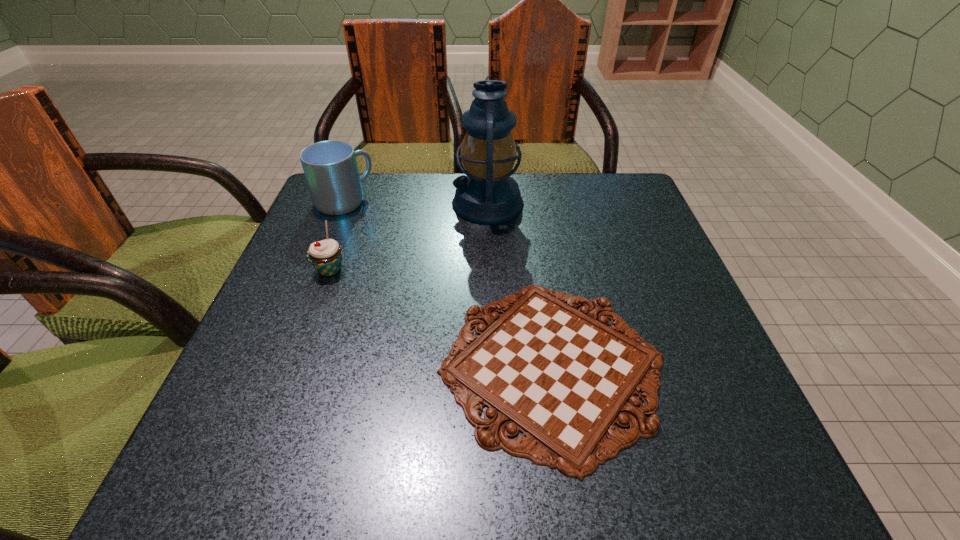
At what (x,y) coordinates should I click in order to perform the action: click on free space located on the right of the second nearest object. Please return your answer as a coordinate pair (x, y). The image size is (960, 540). Looking at the image, I should click on (450, 270).

Where is `free location located on the left of the shortest object`? The width and height of the screenshot is (960, 540). free location located on the left of the shortest object is located at coordinates (269, 365).

Find the location of `lantern positioned at the far edge`. lantern positioned at the far edge is located at coordinates [x=488, y=195].

This screenshot has width=960, height=540. What are the coordinates of `mug that is positioned at the far edge` in the screenshot? It's located at (330, 167).

You are a GUI agent. You are given a task and a screenshot of the screen. Output one action in this format:
    pyautogui.click(x=<x>, y=<y>)
    Task: Click on the object located at the near edge
    The image size is (960, 540).
    Given the screenshot: What is the action you would take?
    pyautogui.click(x=560, y=376)

Where is `mug that is positioned at the left edge`? mug that is positioned at the left edge is located at coordinates (330, 167).

Where is `cupcake situated at the left edge`? Image resolution: width=960 pixels, height=540 pixels. cupcake situated at the left edge is located at coordinates (326, 255).

You are a GUI agent. You are given a task and a screenshot of the screen. Output one action in this format:
    pyautogui.click(x=<x>, y=<y>)
    Task: Click on the object present at the right edge
    The height and width of the screenshot is (540, 960).
    Given the screenshot: What is the action you would take?
    pyautogui.click(x=560, y=376)

Where is `object that is at the far left corner`? The width and height of the screenshot is (960, 540). object that is at the far left corner is located at coordinates (330, 167).

The height and width of the screenshot is (540, 960). Identify the location of object positioned at the near right corner. (560, 376).